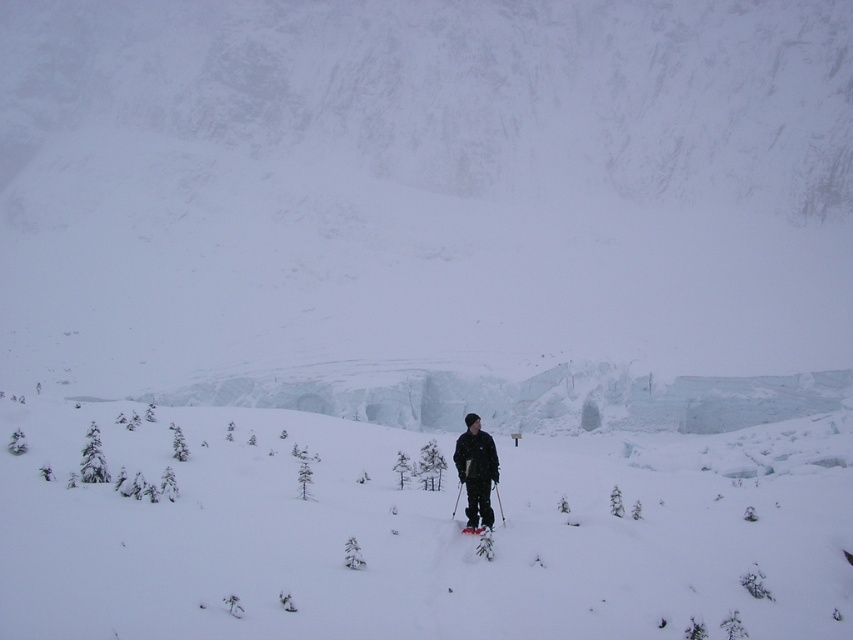
Question: Is shiny red ski at center smaller than white matte ski at center?

Choices:
 (A) yes
 (B) no

Answer: (B)

Question: Considering the relative positions of white fluffy snow at center and black matte jacket at center in the image provided, where is white fluffy snow at center located with respect to black matte jacket at center?

Choices:
 (A) left
 (B) right

Answer: (B)

Question: Based on their relative distances, which object is farther from the white matte ski at center?

Choices:
 (A) white fluffy snow at center
 (B) black matte jacket at center
 (C) shiny red ski at center

Answer: (A)

Question: Is white fluffy snow at center behind white matte ski at center?

Choices:
 (A) yes
 (B) no

Answer: (B)

Question: Among these objects, which one is nearest to the camera?

Choices:
 (A) white fluffy snow at center
 (B) white matte ski at center
 (C) black matte jacket at center
 (D) shiny red ski at center

Answer: (A)

Question: Estimate the real-world distances between objects in this image. Which object is closer to the shiny red ski at center?

Choices:
 (A) black matte jacket at center
 (B) white matte ski at center

Answer: (B)